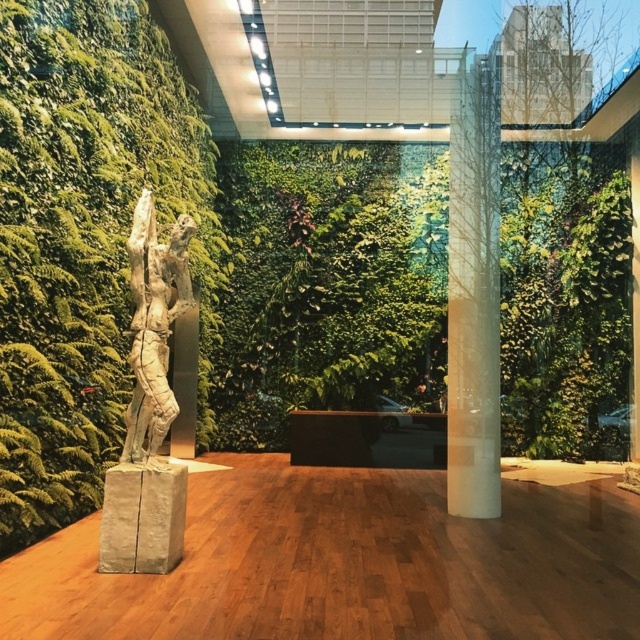
You are an art curator planning to move a large sculpture from the translucent glass column at center to the bronze statue at center. Considering their positions, which object is closer to you and should be considered first for accessibility?

The translucent glass column at center is closer to you than the bronze statue at center, so it should be considered first for accessibility.

You are standing in the modern indoor space and want to place a small potted plant between the two points, point (20, 266) and point (152, 371). Which point should the plant be closer to if it needs to be near the sculptural figure on the left?

The plant should be placed closer to point (20, 266) because it is closer to the viewer and the sculptural figure on the left is located on the left side of the frame.

You are an architect designing a new exhibition space. You need to place a 3.5 meter long sculpture between the translucent glass column at center and the bronze statue at center. Is there enough space between them to accommodate the sculpture?

The translucent glass column at center and bronze statue at center are 2.85 meters apart from each other. Since the sculpture is 3.5 meters long, which is longer than the available space, there is not enough room to place the sculpture between them.